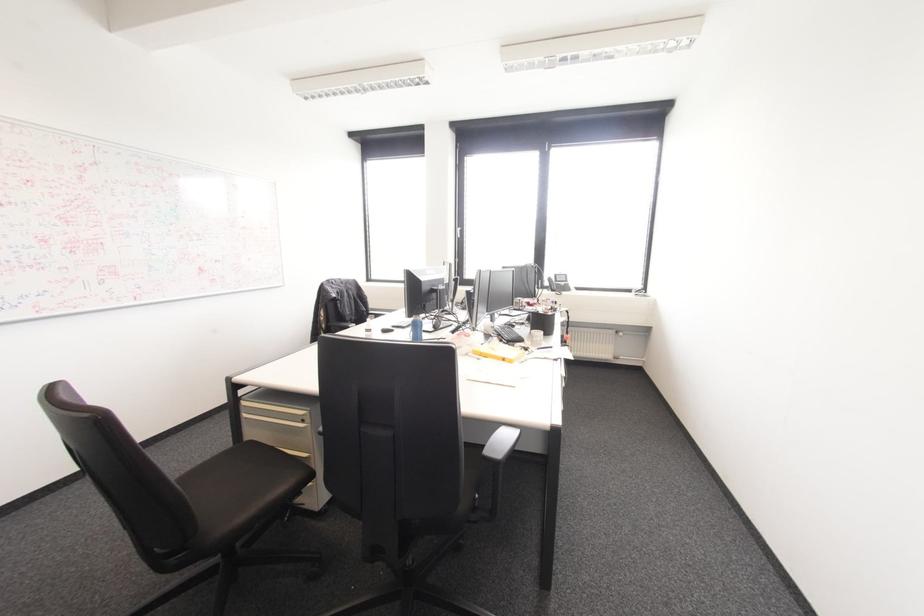
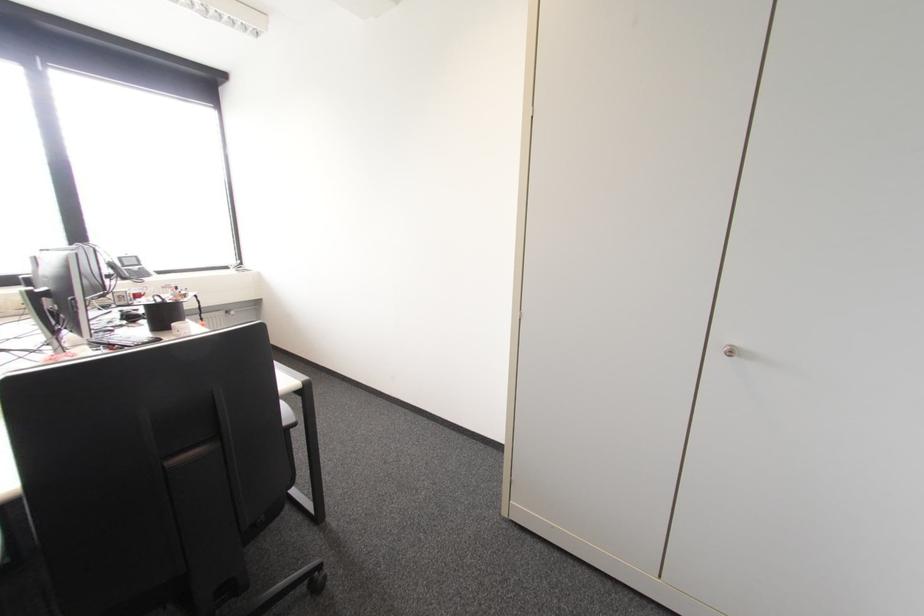
Where in the second image is the point corresponding to pixel 552 290 from the first image?

(123, 278)